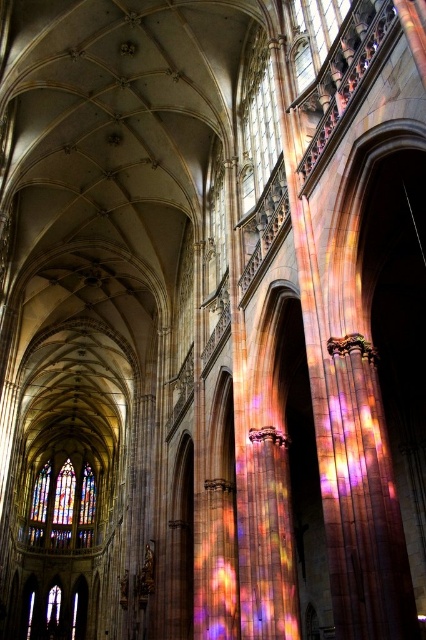
Is stained glass window at left bigger than transparent stained glass at upper center?

Yes, stained glass window at left is bigger than transparent stained glass at upper center.

Is stained glass window at left positioned in front of transparent stained glass at upper center?

No, it is behind transparent stained glass at upper center.

Is point (92, 516) less distant than point (258, 83)?

No, it is behind (258, 83).

At what (x,y) coordinates should I click in order to perform the action: click on stained glass window at left. Please return your answer as a coordinate pair (x, y). Image resolution: width=426 pixels, height=640 pixels. Looking at the image, I should click on (63, 508).